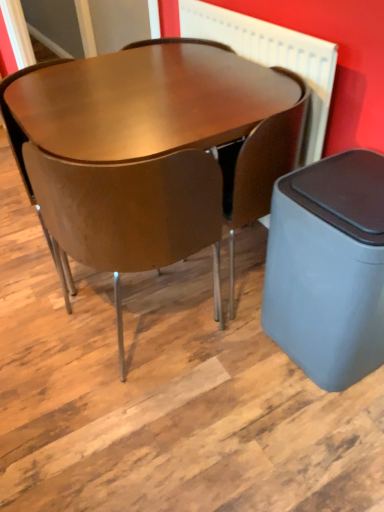
You are a GUI agent. You are given a task and a screenshot of the screen. Output one action in this format:
    pyautogui.click(x=<x>, y=<y>)
    Task: Click on the free spot in front of glossy wood table at center
    The image size is (384, 512).
    Given the screenshot: What is the action you would take?
    pyautogui.click(x=177, y=411)